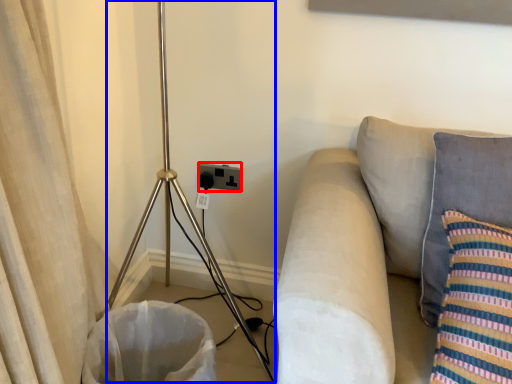
Question: Which point is closer to the camera, electric outlet (highlighted by a red box) or tripod (highlighted by a blue box)?

Choices:
 (A) electric outlet
 (B) tripod

Answer: (B)